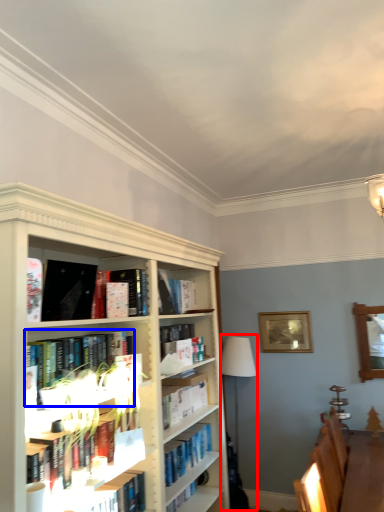
Question: Which object is further to the camera taking this photo, lamp (highlighted by a red box) or book (highlighted by a blue box)?

Choices:
 (A) lamp
 (B) book

Answer: (A)